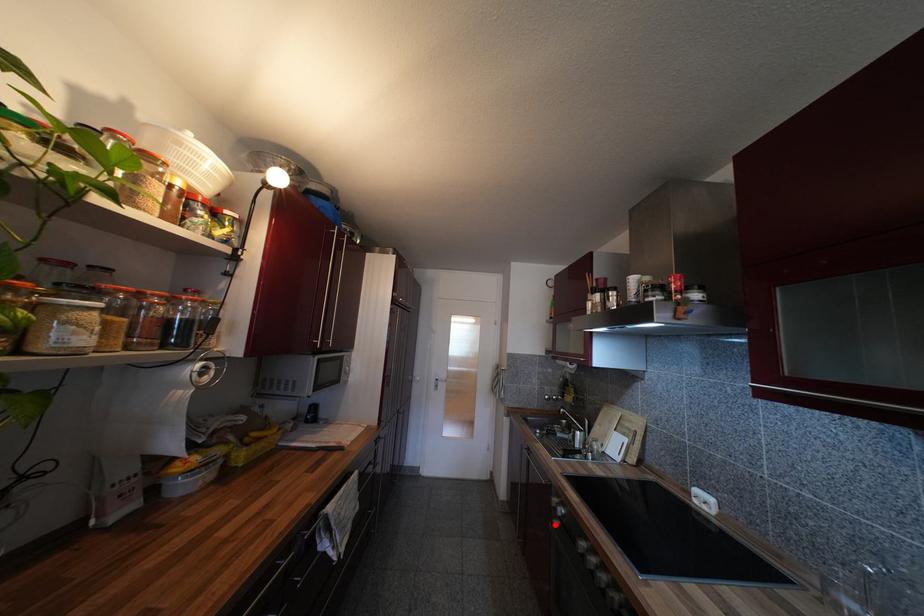
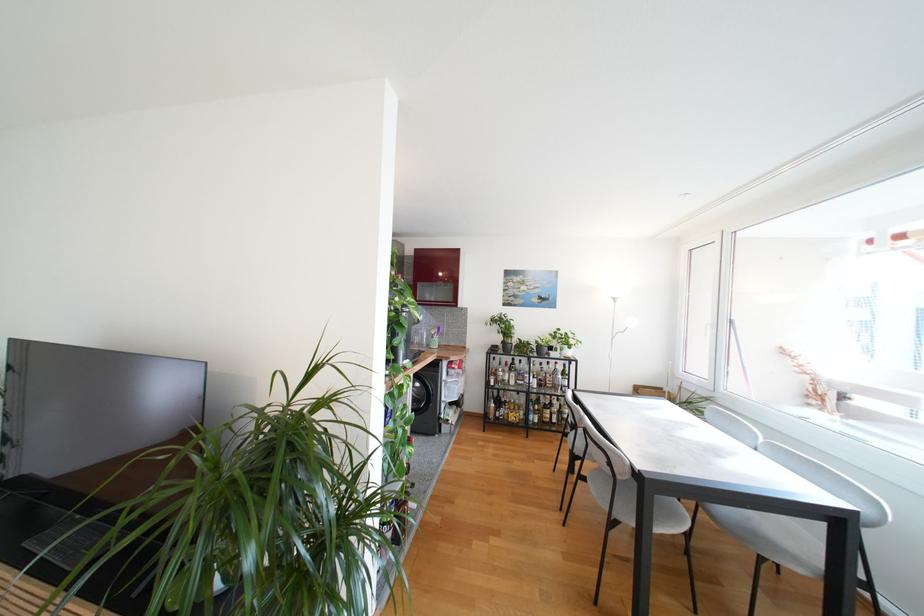
Question: I am providing you with two images of the same scene from different viewpoints. A red point is marked on the first image. At the location where the point appears in image 1, is it still visible in image 2?

Choices:
 (A) Yes
 (B) No

Answer: (B)